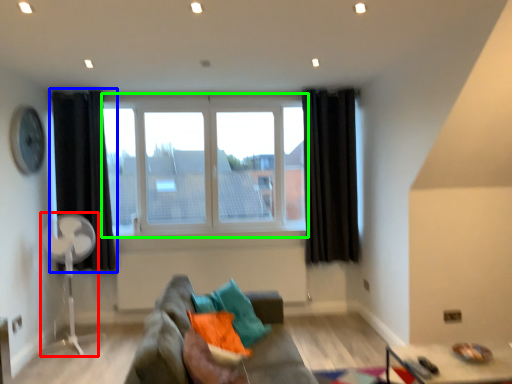
Question: Which is nearer to the fan (highlighted by a red box)? curtain (highlighted by a blue box) or window (highlighted by a green box).

Choices:
 (A) curtain
 (B) window

Answer: (A)